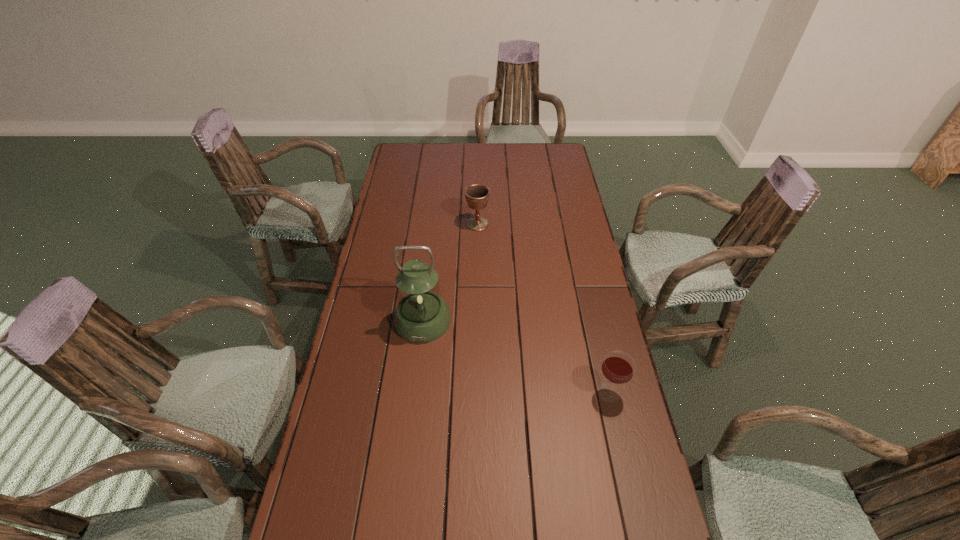
Locate an element on the screen. Image resolution: width=960 pixels, height=540 pixels. unoccupied area between the second object from right to left and the wineglass is located at coordinates (543, 308).

At what (x,y) coordinates should I click in order to perform the action: click on free space between the wineglass and the second object from left to right. Please return your answer as a coordinate pair (x, y). The height and width of the screenshot is (540, 960). Looking at the image, I should click on (543, 308).

Locate an element on the screen. vacant point located between the second farthest object and the chalice is located at coordinates (450, 272).

In order to click on empty space that is in between the chalice and the rightmost object in this screenshot , I will do `click(543, 308)`.

The width and height of the screenshot is (960, 540). In order to click on the second closest object to the second object from left to right in this screenshot , I will do `click(618, 367)`.

Point out which object is positioned as the second nearest to the leftmost object. Please provide its 2D coordinates. Your answer should be formatted as a tuple, i.e. [(x, y)], where the tuple contains the x and y coordinates of a point satisfying the conditions above.

[(618, 367)]

The height and width of the screenshot is (540, 960). Find the location of `free space that satisfies the following two spatial constraints: 1. on the back side of the second object from right to left; 2. on the right side of the leftmost object`. free space that satisfies the following two spatial constraints: 1. on the back side of the second object from right to left; 2. on the right side of the leftmost object is located at coordinates (434, 224).

Identify the location of free spot that satisfies the following two spatial constraints: 1. on the front side of the rightmost object; 2. on the right side of the second object from left to right. (476, 393).

You are a GUI agent. You are given a task and a screenshot of the screen. Output one action in this format:
    pyautogui.click(x=<x>, y=<y>)
    Task: Click on the blank space that satisfies the following two spatial constraints: 1. on the front side of the second nearest object; 2. on the left side of the wineglass
    This screenshot has height=540, width=960.
    Given the screenshot: What is the action you would take?
    pyautogui.click(x=415, y=393)